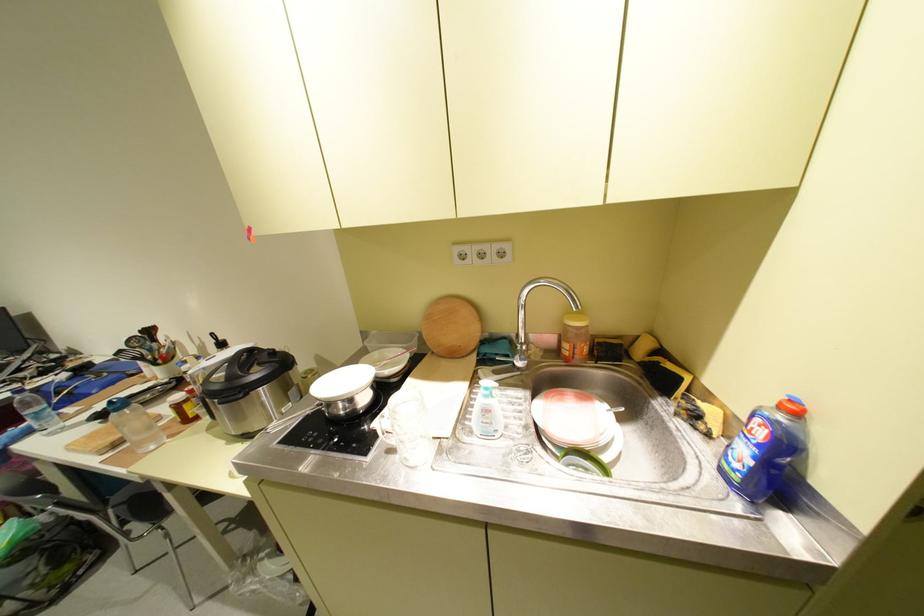
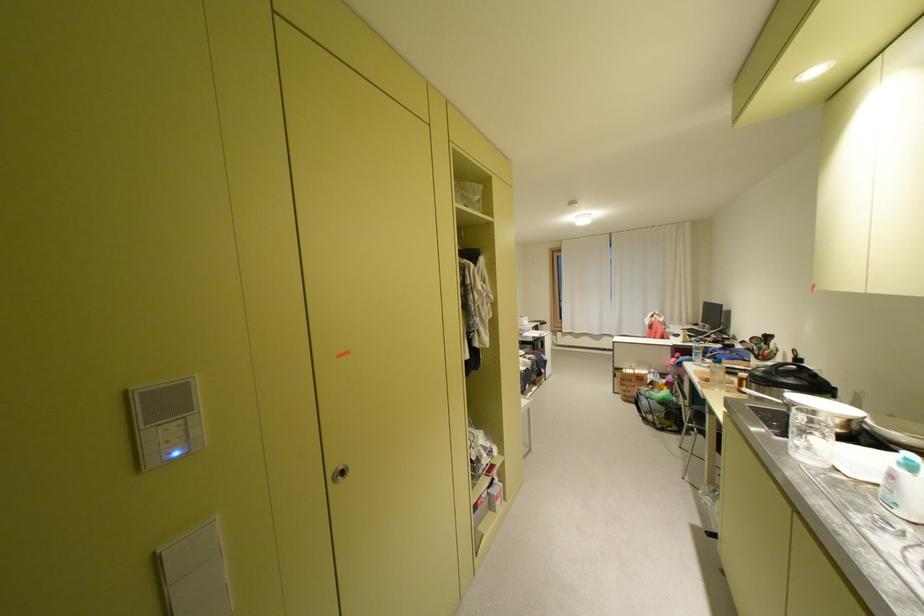
The point at (271, 363) is marked in the first image. Where is the corresponding point in the second image?

(808, 378)